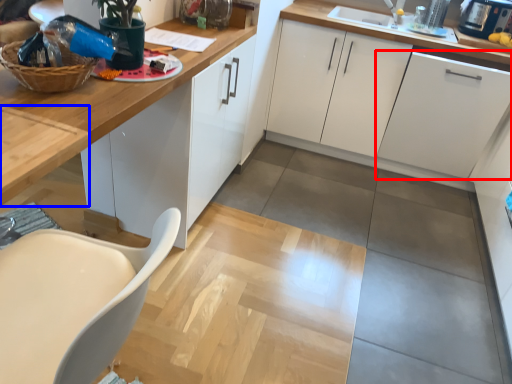
Question: Among these objects, which one is farthest to the camera, cabinetry (highlighted by a red box) or table (highlighted by a blue box)?

Choices:
 (A) cabinetry
 (B) table

Answer: (A)